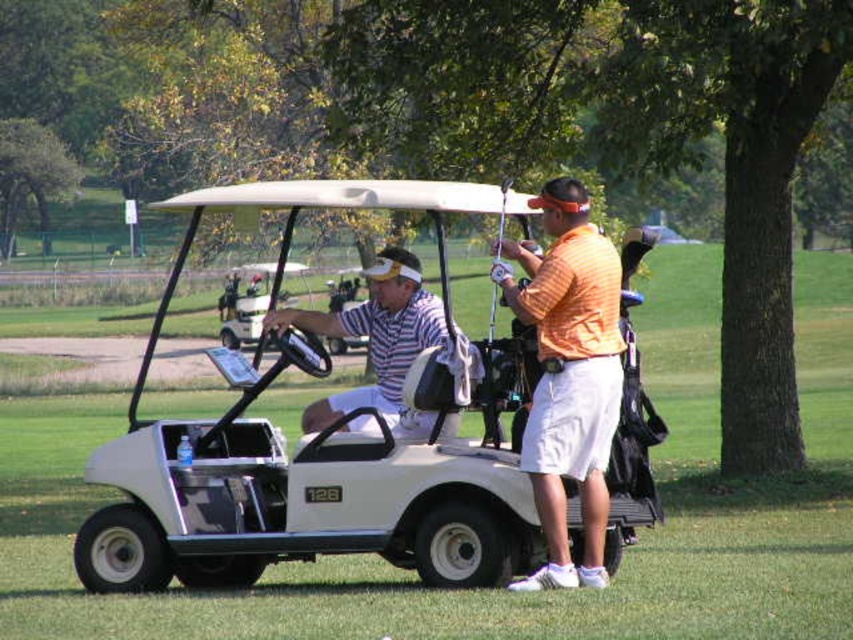
You are a golfer trying to determine the distance between two points on the golf course. You have a rangefinder that can measure distances up to 150 meters. The two points are labeled as point (207, 433) and point (376, 300). According to the image, which point is closer to your current position?

Point (207, 433) is closer to the camera than point (376, 300), so the point closer to your current position is point (207, 433).